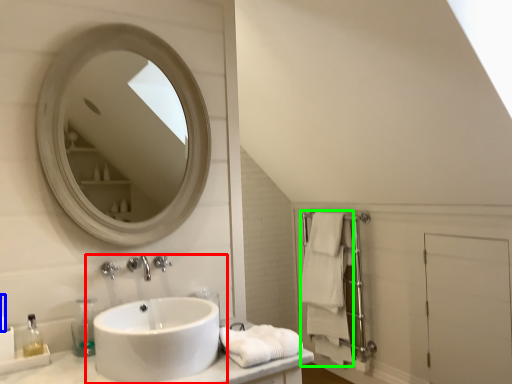
Question: Which object is the farthest from sink (highlighted by a red box)? Choose among these: toiletry (highlighted by a blue box) or bath towel (highlighted by a green box).

Choices:
 (A) toiletry
 (B) bath towel

Answer: (B)